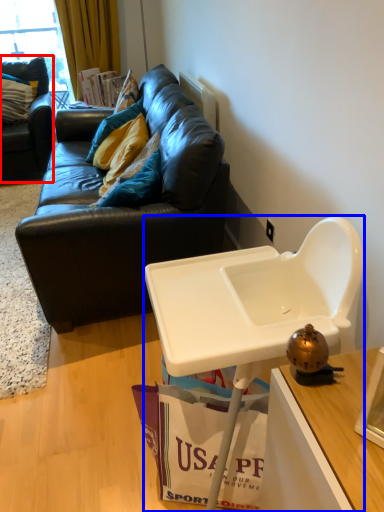
Question: Which object appears closest to the camera in this image, studio couch (highlighted by a red box) or table (highlighted by a blue box)?

Choices:
 (A) studio couch
 (B) table

Answer: (B)